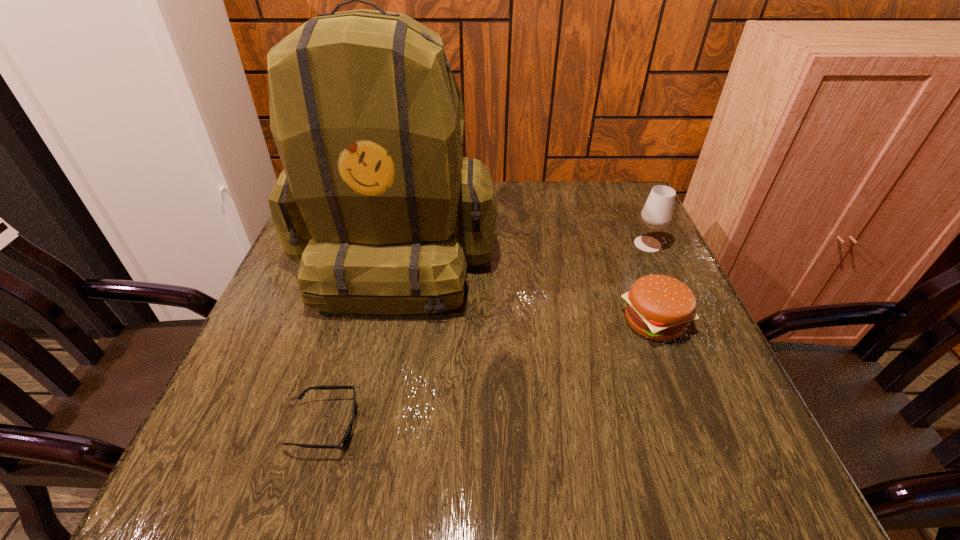
You are a GUI agent. You are given a task and a screenshot of the screen. Output one action in this format:
    pyautogui.click(x=<x>, y=<y>)
    Task: Click on the backpack
    The width and height of the screenshot is (960, 540).
    Given the screenshot: What is the action you would take?
    pyautogui.click(x=376, y=202)

Where is `glass`? glass is located at coordinates (657, 213).

Where is `the third tallest object`? Image resolution: width=960 pixels, height=540 pixels. the third tallest object is located at coordinates (659, 307).

This screenshot has height=540, width=960. I want to click on the shortest object, so click(x=345, y=439).

I want to click on the nearest object, so click(345, 439).

The width and height of the screenshot is (960, 540). What are the coordinates of `vacant space located 0.310m on the front-facing side of the backpack` in the screenshot? It's located at (348, 471).

I want to click on free region located 0.270m on the front of the glass, so click(x=690, y=337).

Identify the location of vacant area situated on the back of the second shortest object. This screenshot has width=960, height=540. (606, 200).

At what (x,y) coordinates should I click in order to perform the action: click on free region located on the front-facing side of the sunglasses. Please return your answer as a coordinate pair (x, y). The height and width of the screenshot is (540, 960). Looking at the image, I should click on (434, 426).

Locate an element on the screen. The height and width of the screenshot is (540, 960). object that is at the far edge is located at coordinates (376, 202).